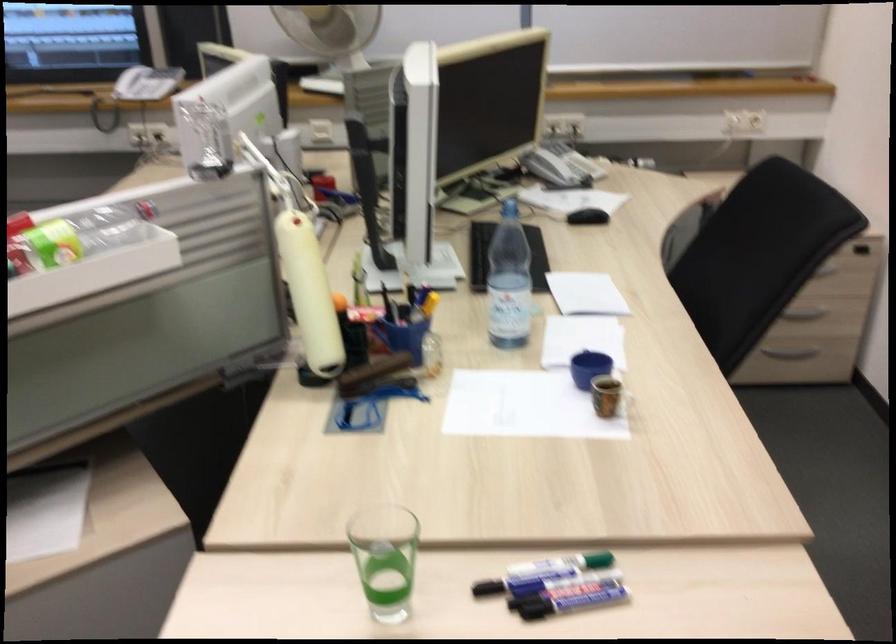
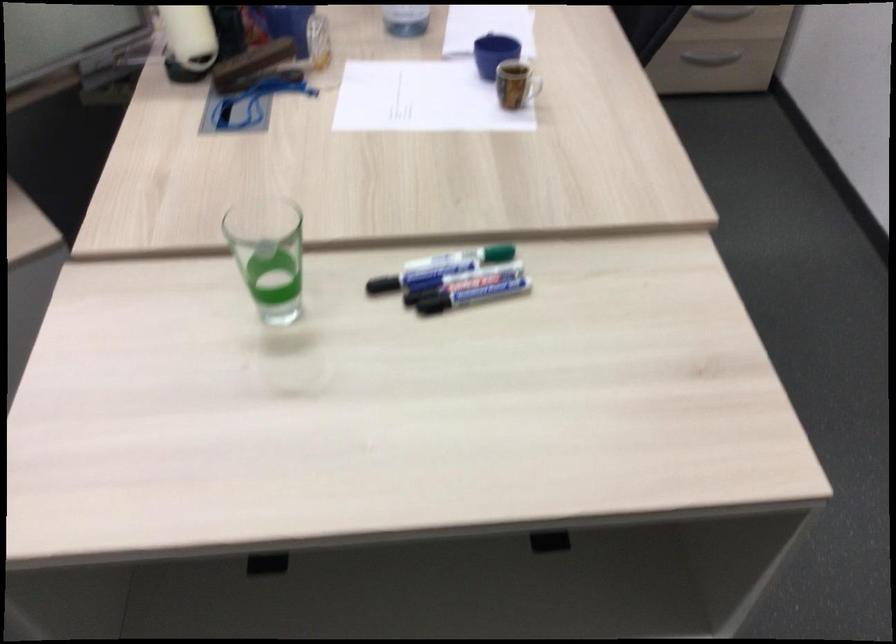
Where in the second image is the point corresponding to (x=567, y=571) from the first image?

(462, 258)